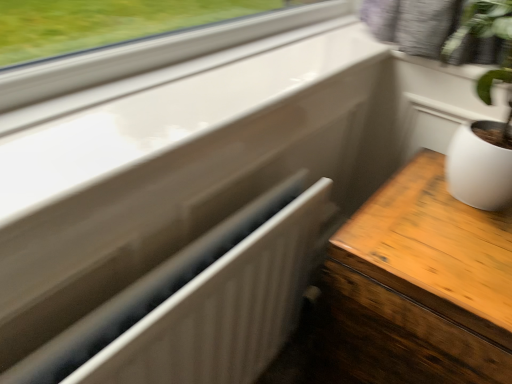
Question: From the image's perspective, relative to white matte radiator at center, is wooden table at right above or below?

Choices:
 (A) above
 (B) below

Answer: (B)

Question: In terms of size, does wooden table at right appear bigger or smaller than white matte radiator at center?

Choices:
 (A) small
 (B) big

Answer: (B)

Question: Does point (415, 274) appear closer or farther from the camera than point (147, 372)?

Choices:
 (A) closer
 (B) farther

Answer: (B)

Question: Is white matte radiator at center bigger or smaller than wooden table at right?

Choices:
 (A) small
 (B) big

Answer: (A)

Question: From the image's perspective, is white matte radiator at center positioned above or below wooden table at right?

Choices:
 (A) below
 (B) above

Answer: (B)

Question: From their relative heights in the image, would you say white matte radiator at center is taller or shorter than wooden table at right?

Choices:
 (A) short
 (B) tall

Answer: (A)

Question: From a real-world perspective, is white matte radiator at center physically located above or below wooden table at right?

Choices:
 (A) above
 (B) below

Answer: (A)